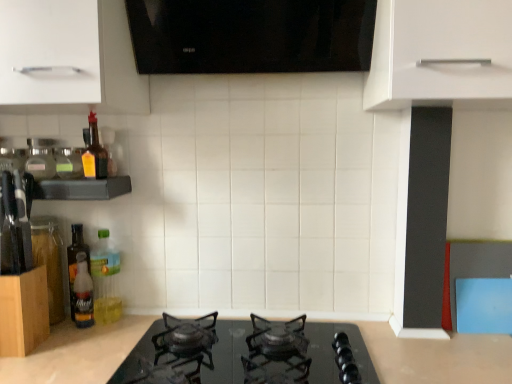
Question: Does translucent glass bottle at left, which is counted as the 2th bottle, starting from the left, have a smaller size compared to white matte cabinet handle at upper left, which is counted as the first cabinetry, starting from the top?

Choices:
 (A) no
 (B) yes

Answer: (B)

Question: Is translucent glass bottle at left, which is counted as the 2th bottle, starting from the left, taller than white matte cabinet handle at upper left, which is counted as the first cabinetry, starting from the top?

Choices:
 (A) yes
 (B) no

Answer: (B)

Question: Can you confirm if translucent glass bottle at left, which is counted as the 2th bottle, starting from the left, is wider than white matte cabinet handle at upper left, marked as the second cabinetry in a bottom-to-top arrangement?

Choices:
 (A) yes
 (B) no

Answer: (B)

Question: Is translucent glass bottle at left, placed as the fifth bottle when sorted from right to left, positioned behind white matte cabinet handle at upper left, marked as the second cabinetry in a bottom-to-top arrangement?

Choices:
 (A) no
 (B) yes

Answer: (B)

Question: Is white matte cabinet handle at upper left, which is counted as the first cabinetry, starting from the top, a part of translucent glass bottle at left, placed as the fifth bottle when sorted from right to left?

Choices:
 (A) no
 (B) yes

Answer: (A)

Question: In terms of size, does translucent glass bottle at left, which is counted as the 2th bottle, starting from the left, appear bigger or smaller than clear glass jar at left, the 1th bottle from the left?

Choices:
 (A) small
 (B) big

Answer: (B)

Question: From a real-world perspective, is translucent glass bottle at left, placed as the fifth bottle when sorted from right to left, positioned above or below clear glass jar at left, the 6th bottle from the right?

Choices:
 (A) below
 (B) above

Answer: (A)

Question: Considering the positions of translucent glass bottle at left, placed as the fifth bottle when sorted from right to left, and clear glass jar at left, the 1th bottle from the left, in the image, is translucent glass bottle at left, placed as the fifth bottle when sorted from right to left, taller or shorter than clear glass jar at left, the 1th bottle from the left,?

Choices:
 (A) short
 (B) tall

Answer: (B)

Question: From the image's perspective, relative to clear glass jar at left, the 6th bottle from the right, is translucent glass bottle at left, which is counted as the 2th bottle, starting from the left, above or below?

Choices:
 (A) below
 (B) above

Answer: (A)

Question: Considering the positions of clear plastic shelf at left and translucent amber glass bottle at left, positioned as the 5th bottle in left-to-right order, in the image, is clear plastic shelf at left wider or thinner than translucent amber glass bottle at left, positioned as the 5th bottle in left-to-right order,?

Choices:
 (A) thin
 (B) wide

Answer: (B)

Question: Looking at the image, does clear plastic shelf at left seem bigger or smaller compared to translucent amber glass bottle at left, positioned as the second bottle in right-to-left order?

Choices:
 (A) small
 (B) big

Answer: (B)

Question: In terms of height, does clear plastic shelf at left look taller or shorter compared to translucent amber glass bottle at left, positioned as the 5th bottle in left-to-right order?

Choices:
 (A) short
 (B) tall

Answer: (A)

Question: Considering the positions of point (108, 183) and point (89, 173), is point (108, 183) closer or farther from the camera than point (89, 173)?

Choices:
 (A) closer
 (B) farther

Answer: (B)

Question: Based on their sizes in the image, would you say translucent yellow bottle at left, positioned as the third bottle in left-to-right order, is bigger or smaller than translucent plastic bottle at left, arranged as the 3th bottle when viewed from the right?

Choices:
 (A) big
 (B) small

Answer: (B)

Question: Is translucent yellow bottle at left, positioned as the third bottle in left-to-right order, situated inside translucent plastic bottle at left, the 4th bottle viewed from the left, or outside?

Choices:
 (A) inside
 (B) outside

Answer: (B)